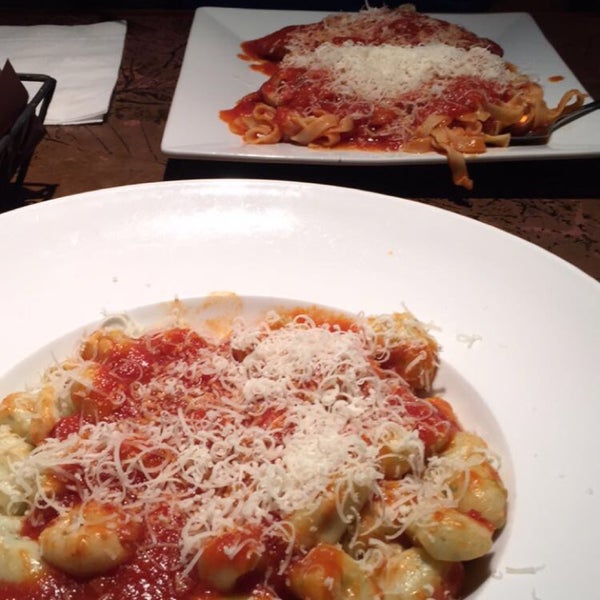
Locate an element on the screen. table is located at coordinates (121, 169).